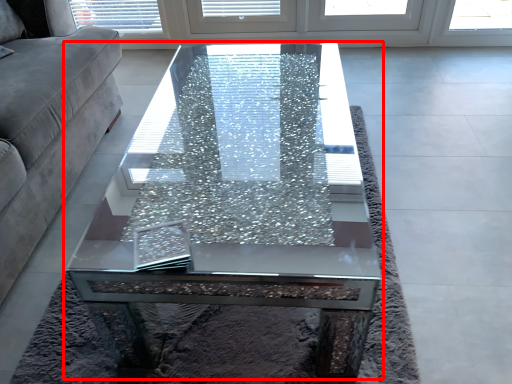
Question: From the image's perspective, what is the correct spatial relationship of coffee table (annotated by the red box) in relation to studio couch?

Choices:
 (A) above
 (B) below

Answer: (B)